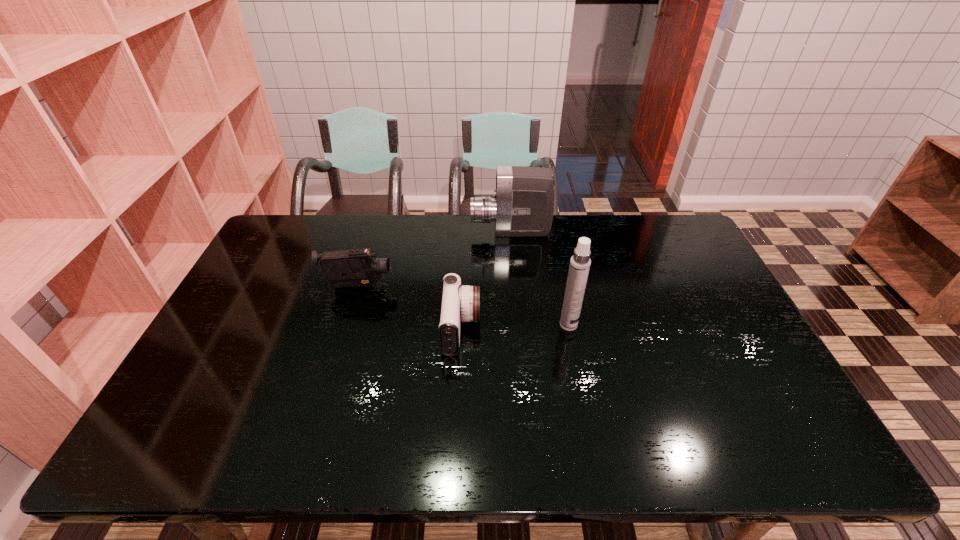
Identify the location of camcorder object that ranks as the second closest to the aerosol can. The width and height of the screenshot is (960, 540). click(523, 205).

Where is `vacant point that satisfies the following two spatial constraints: 1. on the front-facing side of the tallest object; 2. on the left side of the leftmost camcorder`? The height and width of the screenshot is (540, 960). vacant point that satisfies the following two spatial constraints: 1. on the front-facing side of the tallest object; 2. on the left side of the leftmost camcorder is located at coordinates (346, 325).

This screenshot has height=540, width=960. I want to click on vacant area in the image that satisfies the following two spatial constraints: 1. on the front-facing side of the aerosol can; 2. on the left side of the leftmost object, so click(346, 325).

The image size is (960, 540). Find the location of `vacant area in the image that satisfies the following two spatial constraints: 1. at the front of the tallest object, highlighting the lens; 2. on the right side of the farthest camcorder`. vacant area in the image that satisfies the following two spatial constraints: 1. at the front of the tallest object, highlighting the lens; 2. on the right side of the farthest camcorder is located at coordinates (518, 325).

This screenshot has width=960, height=540. I want to click on vacant region that satisfies the following two spatial constraints: 1. on the front-facing side of the leftmost camcorder; 2. on the left side of the tallest object, so click(346, 325).

At what (x,y) coordinates should I click in order to perform the action: click on vacant space that satisfies the following two spatial constraints: 1. at the front of the aerosol can, highlighting the lens; 2. on the left side of the tallest camcorder. Please return your answer as a coordinate pair (x, y). The width and height of the screenshot is (960, 540). Looking at the image, I should click on (518, 325).

Find the location of `vacant space that satisfies the following two spatial constraints: 1. on the front side of the tallest object; 2. on the surface of the nearest camcorder`. vacant space that satisfies the following two spatial constraints: 1. on the front side of the tallest object; 2. on the surface of the nearest camcorder is located at coordinates (569, 328).

Image resolution: width=960 pixels, height=540 pixels. I want to click on blank area in the image that satisfies the following two spatial constraints: 1. at the front of the tallest camcorder, highlighting the lens; 2. on the right side of the tallest object, so click(518, 325).